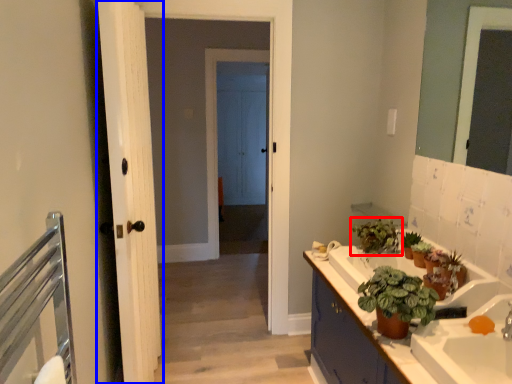
Question: Which object is closer to the camera taking this photo, houseplant (highlighted by a red box) or door (highlighted by a blue box)?

Choices:
 (A) houseplant
 (B) door

Answer: (B)